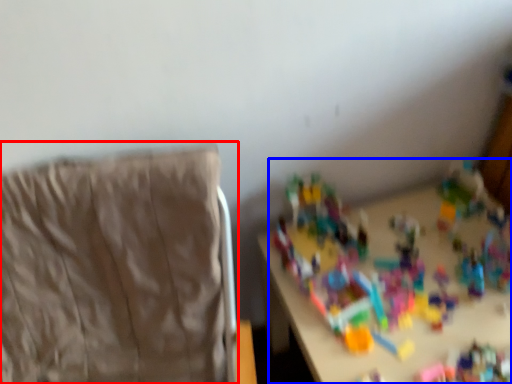
Question: Which of the following is the closest to the observer, furniture (highlighted by a red box) or toy (highlighted by a blue box)?

Choices:
 (A) furniture
 (B) toy

Answer: (A)